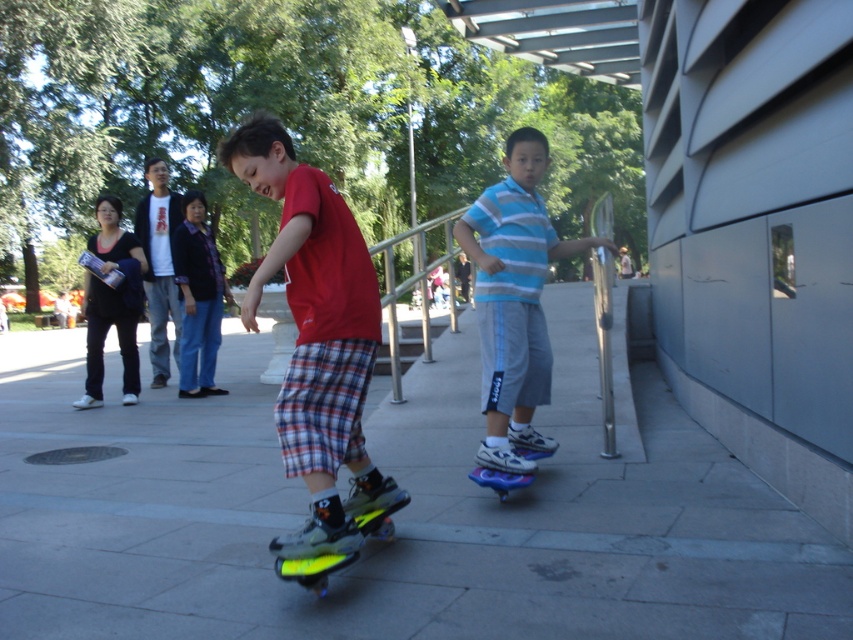
You are a city planner analyzing this skate park layout. The gray concrete pavement at center is crucial for skateboarders. Can you confirm its exact coordinates in the image?

The gray concrete pavement at center is located at coordinates point (398, 513).

You are a delivery drone that needs to land on the gray concrete pavement at center. The neon yellow roller skates at center are in your path. Can you safely land without hitting the roller skates?

The gray concrete pavement at center is 6.46 feet from neon yellow roller skates at center, so yes, the drone can safely land on the gray concrete pavement at center as there is enough distance between them.